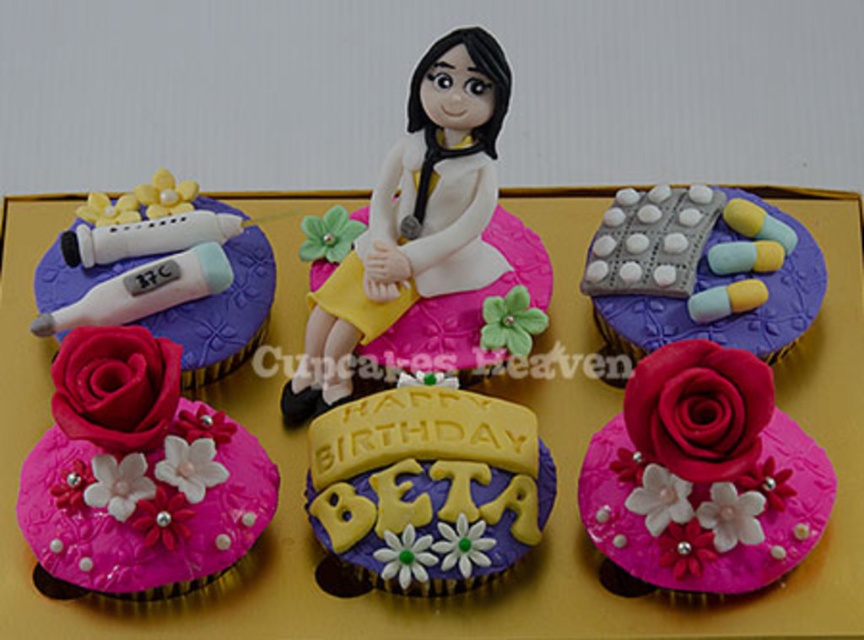
Question: Based on their relative distances, which object is farther from the yellow fondant sign at center?

Choices:
 (A) matte pink rose at lower left
 (B) matte white figurine at center
 (C) gray pill blister pack at upper right
 (D) white glossy thermometer at upper left

Answer: (C)

Question: Does matte pink fondant rose at lower left have a lesser width compared to matte pink rose at lower left?

Choices:
 (A) no
 (B) yes

Answer: (A)

Question: Which of the following is the closest to the observer?

Choices:
 (A) (473, 74)
 (B) (796, 310)
 (C) (760, 541)

Answer: (C)

Question: Considering the relative positions of gray pill blister pack at upper right and white glossy thermometer at upper left in the image provided, where is gray pill blister pack at upper right located with respect to white glossy thermometer at upper left?

Choices:
 (A) right
 (B) left

Answer: (A)

Question: Does matte pink fondant rose at lower left have a lesser width compared to matte white figurine at center?

Choices:
 (A) yes
 (B) no

Answer: (B)

Question: Which point is closer to the camera taking this photo?

Choices:
 (A) (773, 284)
 (B) (693, 397)
 (C) (404, 172)
 (D) (427, 456)

Answer: (B)